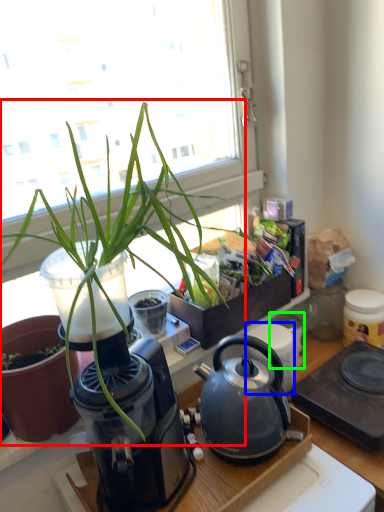
Question: Estimate the real-world distances between objects in this image. Which object is farther from houseplant (highlighted by a red box), appliance (highlighted by a blue box) or appliance (highlighted by a green box)?

Choices:
 (A) appliance
 (B) appliance

Answer: (B)